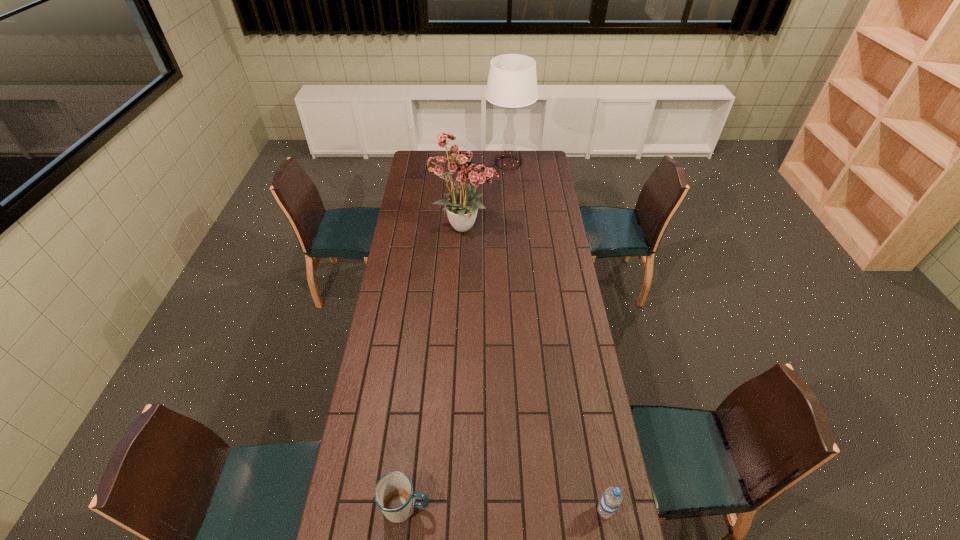
Identify the location of the farthest object. (512, 82).

Locate an element on the screen. The image size is (960, 540). the third nearest object is located at coordinates tap(460, 168).

At what (x,y) coordinates should I click in order to perform the action: click on the second shortest object. Please return your answer as a coordinate pair (x, y). Looking at the image, I should click on (611, 499).

Locate an element on the screen. The height and width of the screenshot is (540, 960). the rightmost object is located at coordinates (611, 499).

Where is `the shortest object`? This screenshot has height=540, width=960. the shortest object is located at coordinates (394, 494).

Locate an element on the screen. This screenshot has height=540, width=960. blank space located on the front-facing side of the table lamp is located at coordinates (512, 206).

Locate an element on the screen. vacant space situated on the front-facing side of the third nearest object is located at coordinates (533, 226).

The image size is (960, 540). Identify the location of vacant region located 0.060m on the label of the third tallest object. (576, 511).

This screenshot has width=960, height=540. I want to click on vacant region located 0.180m on the label of the third tallest object, so click(536, 511).

Where is `vacant space positioned on the label of the third tallest object`? The image size is (960, 540). vacant space positioned on the label of the third tallest object is located at coordinates (512, 511).